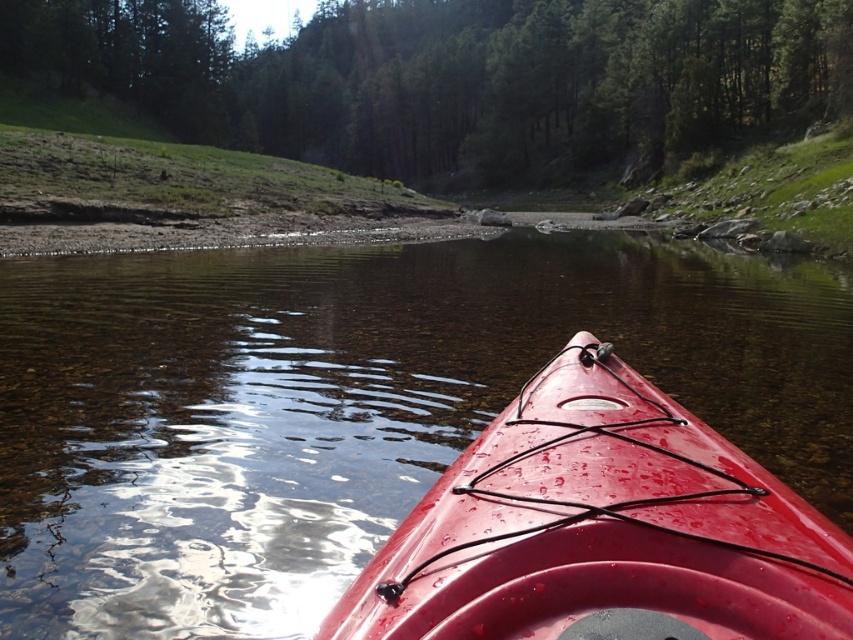
Question: Does transparent plastic kayak at center appear on the right side of glossy plastic kayak at center?

Choices:
 (A) yes
 (B) no

Answer: (B)

Question: Which object appears closest to the camera in this image?

Choices:
 (A) transparent plastic kayak at center
 (B) glossy plastic kayak at center

Answer: (B)

Question: Is transparent plastic kayak at center closer to camera compared to glossy plastic kayak at center?

Choices:
 (A) yes
 (B) no

Answer: (B)

Question: Which of the following is the farthest from the observer?

Choices:
 (A) glossy plastic kayak at center
 (B) transparent plastic kayak at center

Answer: (B)

Question: Considering the relative positions of transparent plastic kayak at center and glossy plastic kayak at center in the image provided, where is transparent plastic kayak at center located with respect to glossy plastic kayak at center?

Choices:
 (A) left
 (B) right

Answer: (A)